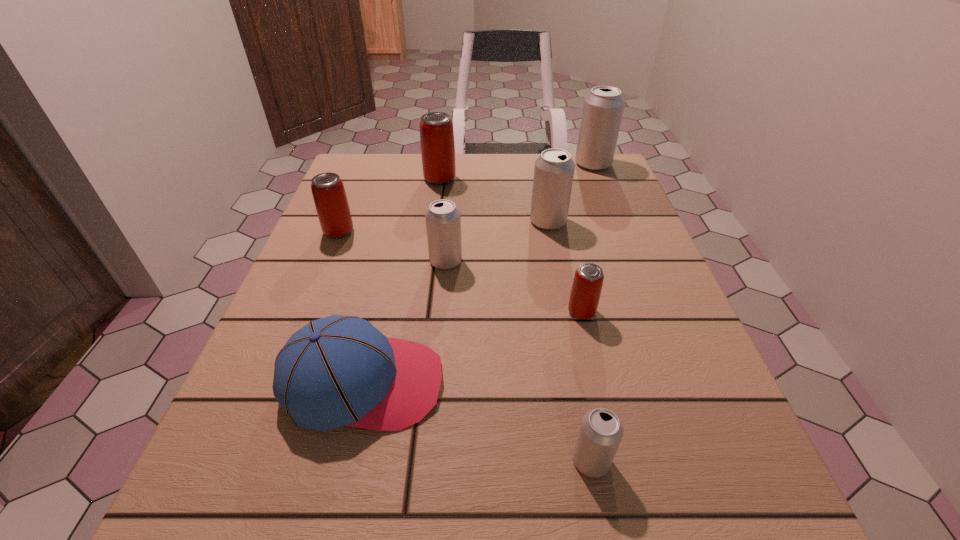
Locate an element on the screen. vacant space that satisfies the following two spatial constraints: 1. on the front-facing side of the seventh farthest object; 2. on the left side of the nearest object is located at coordinates (x=346, y=461).

Locate an element on the screen. This screenshot has width=960, height=540. free space that satisfies the following two spatial constraints: 1. on the front side of the smallest pink beer can; 2. on the right side of the leftmost white beer can is located at coordinates (442, 312).

Locate an element on the screen. vacant space that satisfies the following two spatial constraints: 1. on the back side of the third nearest object; 2. on the left side of the tallest object is located at coordinates (547, 164).